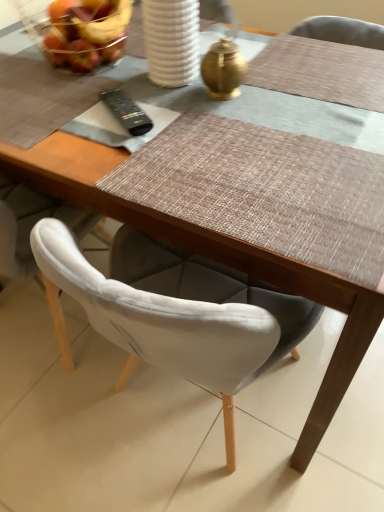
This screenshot has height=512, width=384. Find the location of `unoccupied space behind black plastic remote at center`. unoccupied space behind black plastic remote at center is located at coordinates (x=123, y=83).